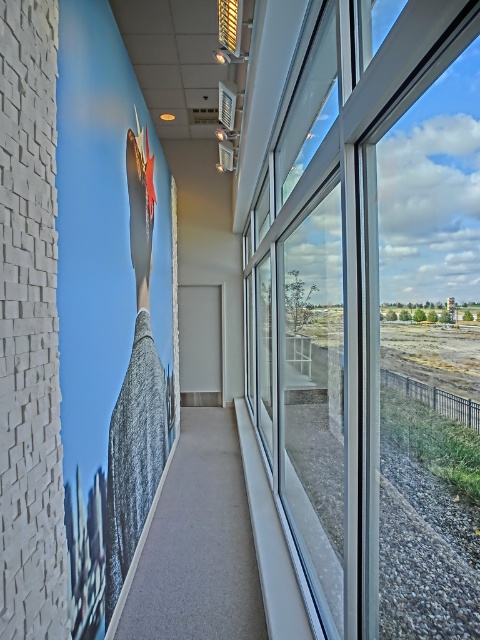
Question: Is the position of transparent glass window at right more distant than that of gray fabric at left?

Choices:
 (A) no
 (B) yes

Answer: (A)

Question: Can you confirm if transparent glass window at right is smaller than gray fabric at left?

Choices:
 (A) no
 (B) yes

Answer: (A)

Question: Which point is farther to the camera?

Choices:
 (A) gray fabric at left
 (B) transparent glass window at right

Answer: (A)

Question: Among these points, which one is nearest to the camera?

Choices:
 (A) (349, 116)
 (B) (129, 161)

Answer: (A)

Question: Can you confirm if transparent glass window at right is positioned to the right of gray fabric at left?

Choices:
 (A) no
 (B) yes

Answer: (B)